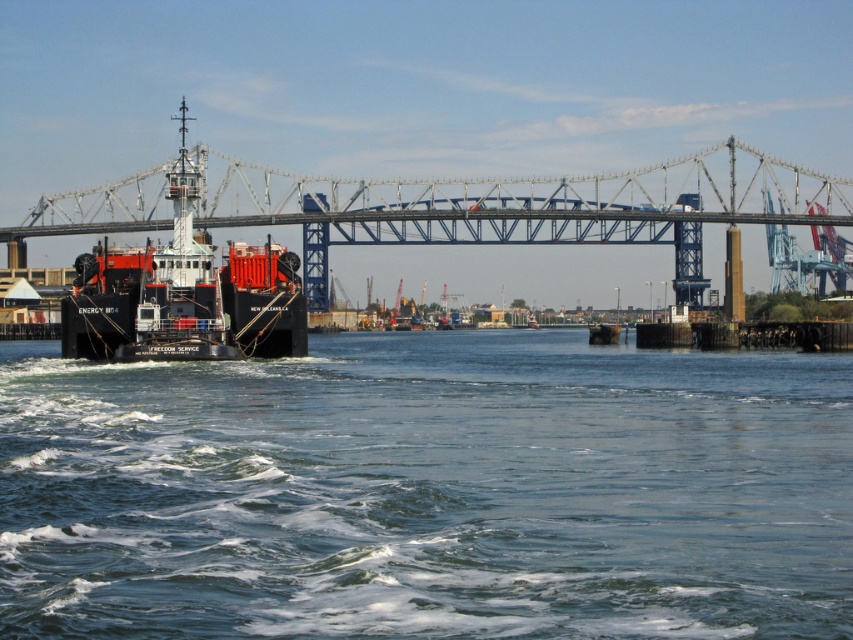
Question: Among these points, which one is farthest from the camera?

Choices:
 (A) (531, 403)
 (B) (268, 170)
 (C) (171, 172)

Answer: (B)

Question: Which of the following is the farthest from the observer?

Choices:
 (A) (1, 579)
 (B) (488, 193)

Answer: (B)

Question: In this image, where is metal bridge at center located relative to matte black ship at left?

Choices:
 (A) left
 (B) right

Answer: (B)

Question: Which point appears farthest from the camera in this image?

Choices:
 (A) click(595, 204)
 (B) click(683, 461)
 (C) click(282, 323)

Answer: (A)

Question: Can you confirm if clear blue water at lower center is thinner than metal bridge at center?

Choices:
 (A) yes
 (B) no

Answer: (A)

Question: Does clear blue water at lower center lie in front of matte black ship at left?

Choices:
 (A) yes
 (B) no

Answer: (A)